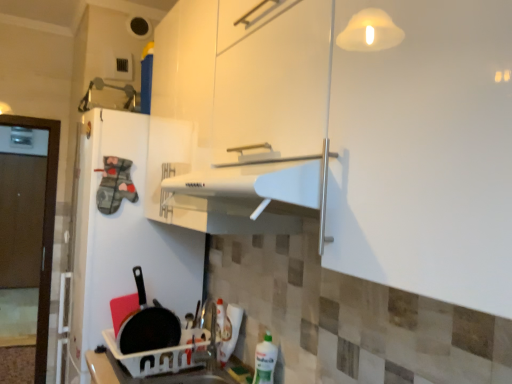
In order to face green plastic bottle at lower right, should I rotate leftwards or rightwards?

You should look right and rotate roughly 0.899 degrees.

The width and height of the screenshot is (512, 384). I want to click on white matte refrigerator at left, so click(122, 238).

Locate an element on the screen. black matte frying pan at lower left is located at coordinates (147, 325).

From the picture: Is white plastic sink at lower center completely or partially outside of black matte frying pan at lower left?

Indeed, white plastic sink at lower center is completely outside black matte frying pan at lower left.

From the image's perspective, is white plastic sink at lower center above or below black matte frying pan at lower left?

Clearly, from the image's perspective, white plastic sink at lower center is below black matte frying pan at lower left.

Is white plastic sink at lower center not near black matte frying pan at lower left?

That's not correct — white plastic sink at lower center is a little close to black matte frying pan at lower left.

Does white matte refrigerator at left have a smaller size compared to black matte frying pan at lower left?

Actually, white matte refrigerator at left might be larger than black matte frying pan at lower left.

Is white matte refrigerator at left situated inside black matte frying pan at lower left or outside?

white matte refrigerator at left lies outside black matte frying pan at lower left.

There is a black matte frying pan at lower left. In order to click on fridge above it (from a real-world perspective) in this screenshot , I will do `click(122, 238)`.

In the scene shown: Looking at their sizes, would you say white matte refrigerator at left is wider or thinner than black matte frying pan at lower left?

white matte refrigerator at left is wider than black matte frying pan at lower left.

Is the position of black matte frying pan at lower left less distant than that of white matte refrigerator at left?

Yes, the depth of black matte frying pan at lower left is less than that of white matte refrigerator at left.

From the image's perspective, which is below, black matte frying pan at lower left or white matte refrigerator at left?

black matte frying pan at lower left.

From a real-world perspective, is black matte frying pan at lower left positioned under white matte refrigerator at left based on gravity?

Indeed, from a real-world perspective, black matte frying pan at lower left is positioned beneath white matte refrigerator at left.

Which of these two, black matte frying pan at lower left or white matte refrigerator at left, is smaller?

black matte frying pan at lower left.

Does green plastic bottle at lower right appear on the left side of white matte refrigerator at left?

No, green plastic bottle at lower right is not to the left of white matte refrigerator at left.

Between green plastic bottle at lower right and white matte refrigerator at left, which one has more height?

white matte refrigerator at left is taller.

From the image's perspective, is green plastic bottle at lower right on top of white matte refrigerator at left?

Actually, green plastic bottle at lower right appears below white matte refrigerator at left in the image.

Is the depth of green plastic bottle at lower right greater than that of white matte refrigerator at left?

That is False.

Would you say white plastic sink at lower center is part of white matte refrigerator at left's contents?

Actually, white plastic sink at lower center is outside white matte refrigerator at left.

Between point (101, 138) and point (105, 357), which one is positioned in front?

Point (105, 357)

Is there a large distance between white matte refrigerator at left and white plastic sink at lower center?

No, there isn't a large distance between white matte refrigerator at left and white plastic sink at lower center.

Would you say black matte frying pan at lower left is inside or outside green plastic bottle at lower right?

black matte frying pan at lower left is located beyond the bounds of green plastic bottle at lower right.

I want to click on frying pan above the green plastic bottle at lower right (from a real-world perspective), so click(x=147, y=325).

How different are the orientations of green plastic bottle at lower right and black matte frying pan at lower left in degrees?

green plastic bottle at lower right and black matte frying pan at lower left are facing 95.5 degrees away from each other.

Considering the relative sizes of green plastic bottle at lower right and black matte frying pan at lower left in the image provided, is green plastic bottle at lower right wider than black matte frying pan at lower left?

Yes.

How much distance is there between green plastic bottle at lower right and black matte frying pan at lower left?

green plastic bottle at lower right is 19.58 inches from black matte frying pan at lower left.

Considering their positions, is green plastic bottle at lower right located in front of or behind black matte frying pan at lower left?

In the image, green plastic bottle at lower right appears in front of black matte frying pan at lower left.

Where is `counter top on the right of black matte frying pan at lower left`? This screenshot has width=512, height=384. counter top on the right of black matte frying pan at lower left is located at coordinates (148, 377).

In order to click on fridge to the left of black matte frying pan at lower left in this screenshot , I will do `click(122, 238)`.

Based on their spatial positions, is black matte frying pan at lower left or white matte refrigerator at left further from white plastic sink at lower center?

white matte refrigerator at left is further to white plastic sink at lower center.

Estimate the real-world distances between objects in this image. Which object is further from black matte frying pan at lower left, white plastic sink at lower center or green plastic bottle at lower right?

green plastic bottle at lower right.

When comparing their distances from white matte refrigerator at left, does white plastic sink at lower center or green plastic bottle at lower right seem closer?

Among the two, white plastic sink at lower center is located nearer to white matte refrigerator at left.

From the image, which object appears to be nearer to white plastic sink at lower center, green plastic bottle at lower right or white matte refrigerator at left?

green plastic bottle at lower right.

Looking at the image, which one is located further to black matte frying pan at lower left, white plastic sink at lower center or white matte refrigerator at left?

white matte refrigerator at left is further to black matte frying pan at lower left.

When comparing their distances from white plastic sink at lower center, does white matte refrigerator at left or black matte frying pan at lower left seem closer?

black matte frying pan at lower left lies closer to white plastic sink at lower center than the other object.

Which object lies further to the anchor point black matte frying pan at lower left, green plastic bottle at lower right or white matte refrigerator at left?

The object further to black matte frying pan at lower left is green plastic bottle at lower right.

Based on the photo, considering their positions, is black matte frying pan at lower left positioned closer to green plastic bottle at lower right than white plastic sink at lower center?

white plastic sink at lower center is positioned closer to the anchor green plastic bottle at lower right.

The image size is (512, 384). I want to click on counter top between black matte frying pan at lower left and green plastic bottle at lower right, so click(148, 377).

Locate an element on the screen. The height and width of the screenshot is (384, 512). counter top between white matte refrigerator at left and green plastic bottle at lower right from left to right is located at coordinates (148, 377).

I want to click on frying pan between white matte refrigerator at left and green plastic bottle at lower right in the horizontal direction, so click(x=147, y=325).

Identify the location of frying pan between white matte refrigerator at left and white plastic sink at lower center vertically. (147, 325).